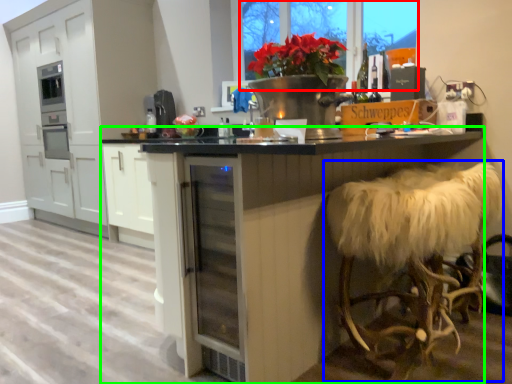
Question: Based on their relative distances, which object is nearer to window screen (highlighted by a red box)? Choose from swivel chair (highlighted by a blue box) and table (highlighted by a green box).

Choices:
 (A) swivel chair
 (B) table

Answer: (B)